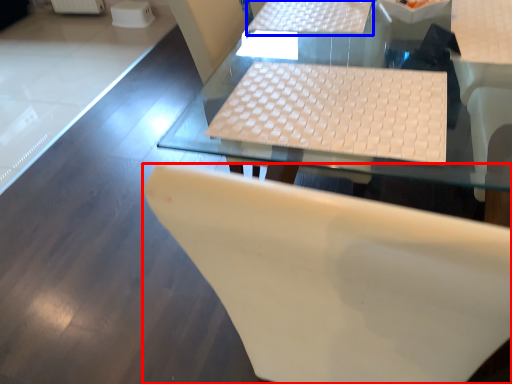
Question: Which object appears closest to the camera in this image, chair (highlighted by a red box) or table (highlighted by a blue box)?

Choices:
 (A) chair
 (B) table

Answer: (A)